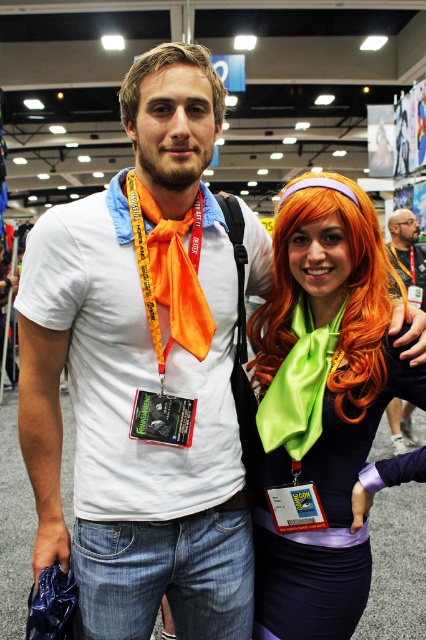
Question: Estimate the real-world distances between objects in this image. Which object is closer to the matte orange scarf at center?

Choices:
 (A) green satin scarf at center
 (B) orange silky wig at center
 (C) brown matte hair at upper center

Answer: (B)

Question: Does green satin scarf at center come in front of green satin lanyard at center?

Choices:
 (A) yes
 (B) no

Answer: (A)

Question: Among these objects, which one is farthest from the camera?

Choices:
 (A) green satin scarf at center
 (B) brown matte hair at upper center

Answer: (A)

Question: Does orange silky wig at center come in front of yellow fabric lanyard at center?

Choices:
 (A) yes
 (B) no

Answer: (A)

Question: Estimate the real-world distances between objects in this image. Which object is farther from the brown matte hair at upper center?

Choices:
 (A) yellow fabric lanyard at center
 (B) green satin lanyard at center

Answer: (A)

Question: In this image, where is orange fabric lanyard at center located relative to yellow fabric lanyard at center?

Choices:
 (A) left
 (B) right

Answer: (A)